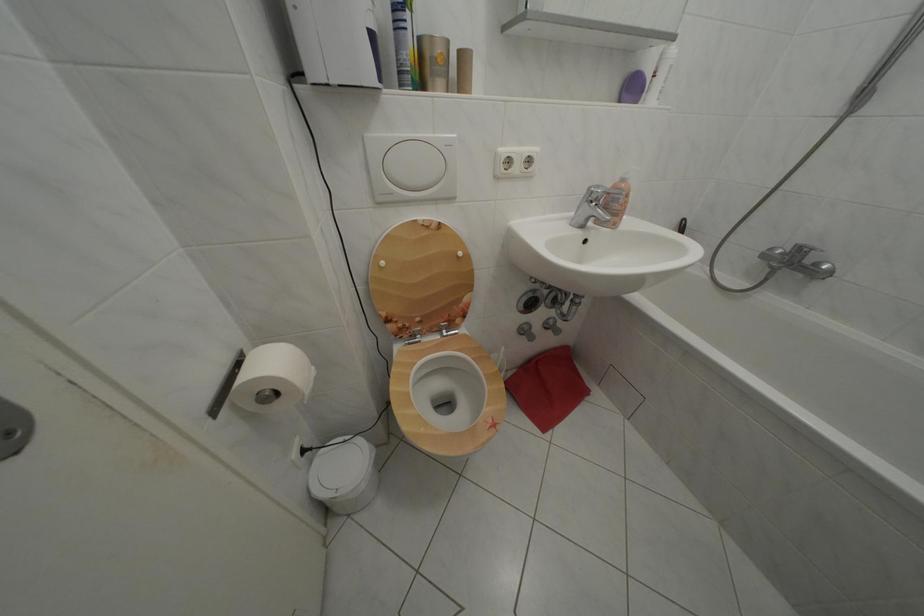
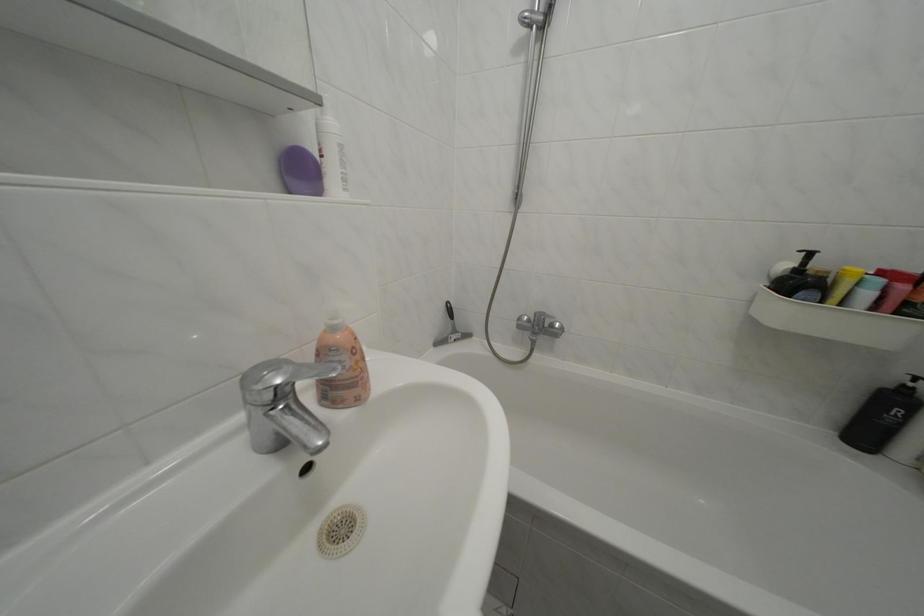
Locate, in the second image, the point that corresponds to pixel 824 270 in the first image.

(562, 331)